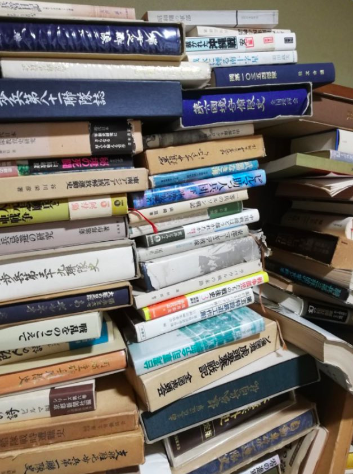
Locate an element on the screen. The height and width of the screenshot is (474, 353). wall in bachground right upper corner is located at coordinates (337, 32).